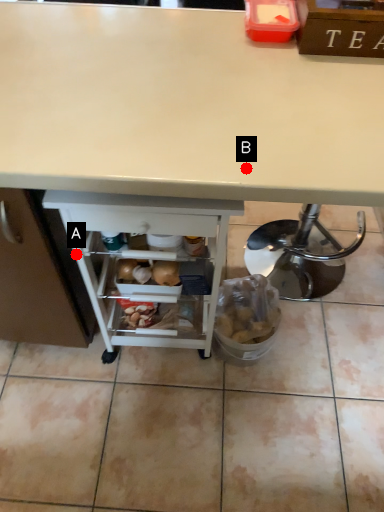
Question: Two points are circled on the image, labeled by A and B beside each circle. Among these points, which one is farthest from the camera?

Choices:
 (A) A is further
 (B) B is further

Answer: (A)